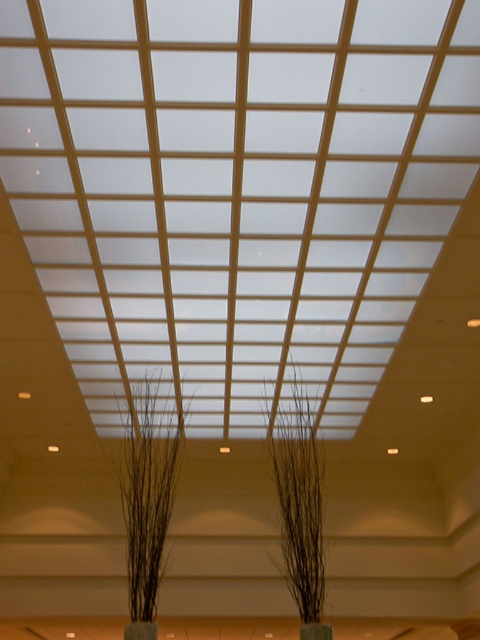
You are an interior designer arranging items in the room. You have a brown matte plant at center and a green matte vase at center. Which object is wider?

The brown matte plant at center is wider than the green matte vase at center.

Based on the photo, you are standing in the room and want to place a small decorative item between the black matte plant at center and the green matte vase at center. Based on their positions, where should you place the item?

The green matte vase at center is behind the black matte plant at center, so you should place the item in front of the green matte vase at center and behind the black matte plant at center to position it between them.